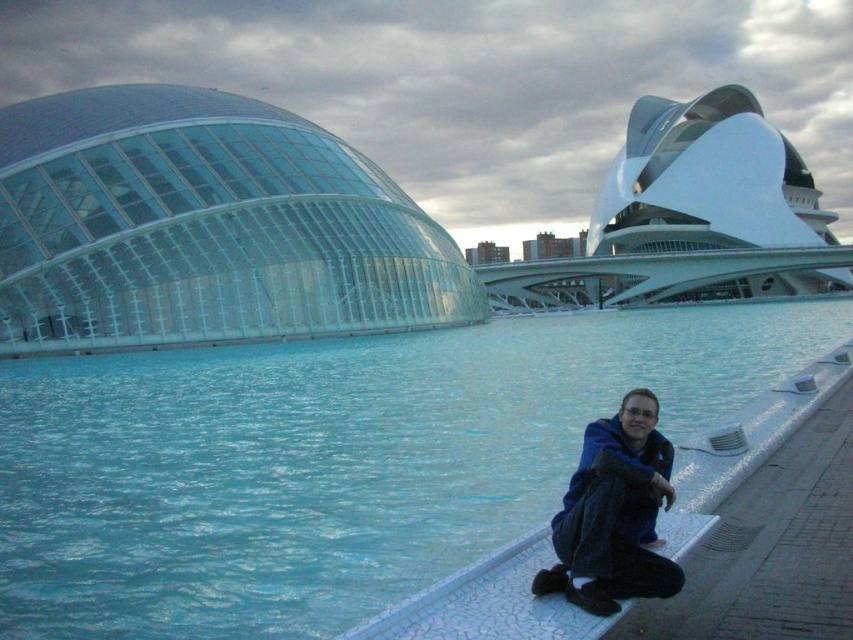
Does blue glass water at center have a greater width compared to blue fleece jacket at lower right?

Correct, the width of blue glass water at center exceeds that of blue fleece jacket at lower right.

Does blue glass water at center appear on the left side of blue fleece jacket at lower right?

Incorrect, blue glass water at center is not on the left side of blue fleece jacket at lower right.

You are a GUI agent. You are given a task and a screenshot of the screen. Output one action in this format:
    pyautogui.click(x=<x>, y=<y>)
    Task: Click on the blue glass water at center
    This screenshot has width=853, height=640.
    Given the screenshot: What is the action you would take?
    pyautogui.click(x=331, y=461)